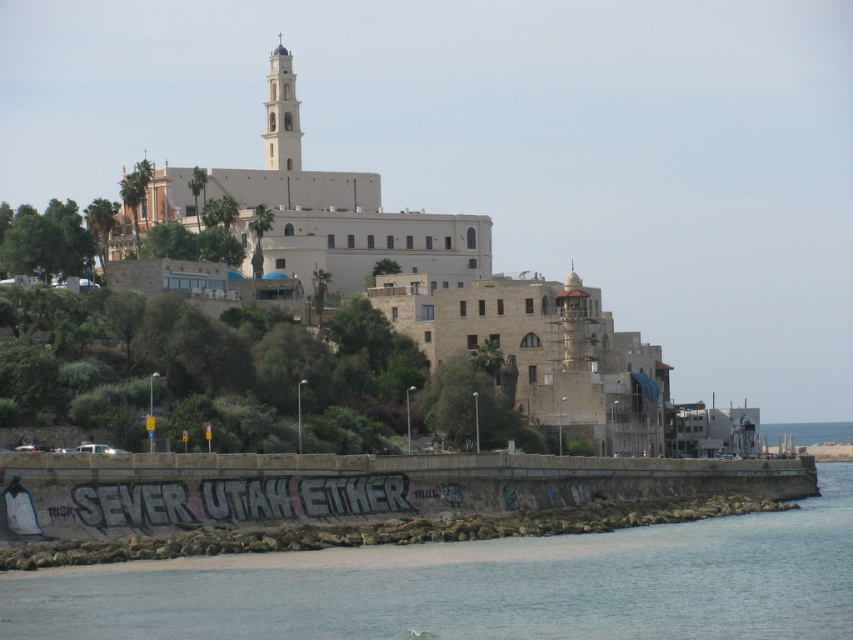
Question: Which object appears farthest from the camera in this image?

Choices:
 (A) blue water at lower right
 (B) clear water at lower left
 (C) white stone tower at upper center

Answer: (A)

Question: Which of the following is the closest to the observer?

Choices:
 (A) white stone tower at upper center
 (B) clear water at lower left

Answer: (B)

Question: Which point appears farthest from the camera in this image?

Choices:
 (A) (291, 92)
 (B) (811, 432)

Answer: (B)

Question: Is white stone tower at upper center to the left of blue water at lower right from the viewer's perspective?

Choices:
 (A) no
 (B) yes

Answer: (B)

Question: Does clear water at lower left appear on the right side of blue water at lower right?

Choices:
 (A) yes
 (B) no

Answer: (B)

Question: Can you confirm if clear water at lower left is thinner than white stone tower at upper center?

Choices:
 (A) yes
 (B) no

Answer: (B)